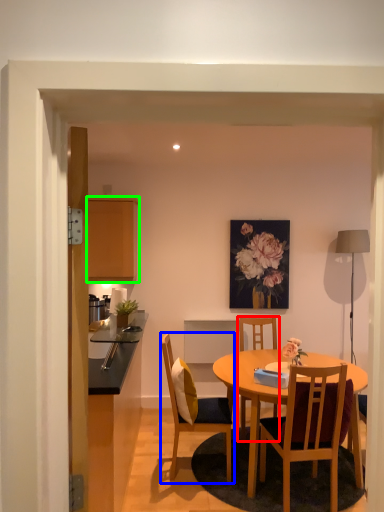
Question: Which is nearer to the chair (highlighted by a red box)? chair (highlighted by a blue box) or cabinetry (highlighted by a green box).

Choices:
 (A) chair
 (B) cabinetry

Answer: (A)